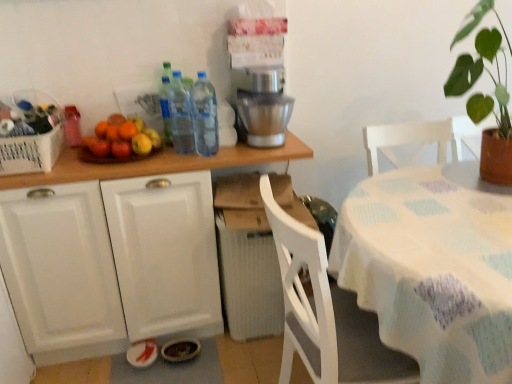
At what (x,y) coordinates should I click in order to perform the action: click on unoccupied area in front of transparent plastic bottle at center, the 1th bottle viewed from the right. Please return your answer as a coordinate pair (x, y). The width and height of the screenshot is (512, 384). Looking at the image, I should click on (x=205, y=159).